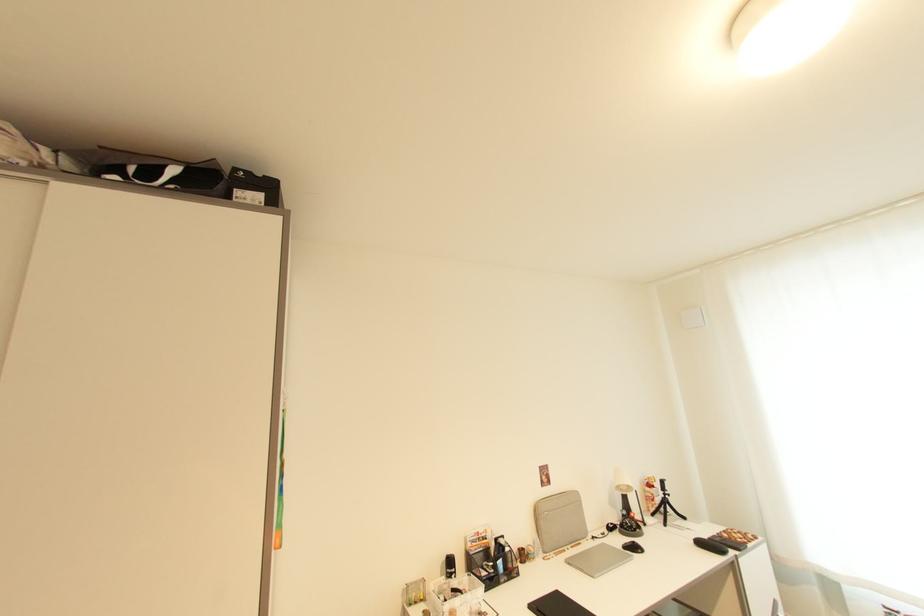
Where would you lift the grey laptop case? Please return your answer as a coordinate pair (x, y).

(560, 521)